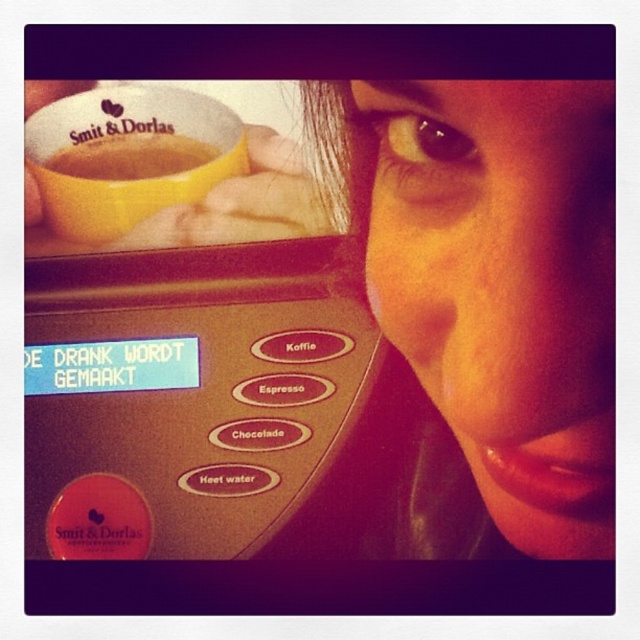
Question: Is the position of smooth skin face at upper right more distant than that of yellow matte cup at upper left?

Choices:
 (A) yes
 (B) no

Answer: (B)

Question: Is smooth skin face at upper right further to the viewer compared to golden plastic cup at upper left?

Choices:
 (A) yes
 (B) no

Answer: (B)

Question: Estimate the real-world distances between objects in this image. Which object is farther from the golden plastic cup at upper left?

Choices:
 (A) yellow matte cup at upper left
 (B) smooth skin face at upper right

Answer: (B)

Question: Among these objects, which one is farthest from the camera?

Choices:
 (A) golden plastic cup at upper left
 (B) yellow matte cup at upper left

Answer: (A)

Question: Can you confirm if smooth skin face at upper right is positioned below yellow matte cup at upper left?

Choices:
 (A) yes
 (B) no

Answer: (A)

Question: Which object appears farthest from the camera in this image?

Choices:
 (A) golden plastic cup at upper left
 (B) smooth skin face at upper right
 (C) yellow matte cup at upper left

Answer: (A)